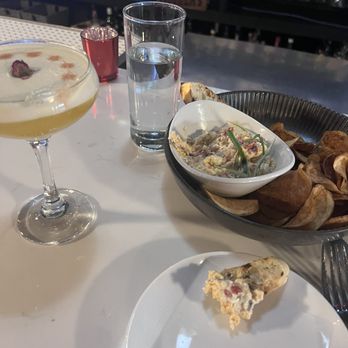
The height and width of the screenshot is (348, 348). I want to click on bowl, so click(187, 124).